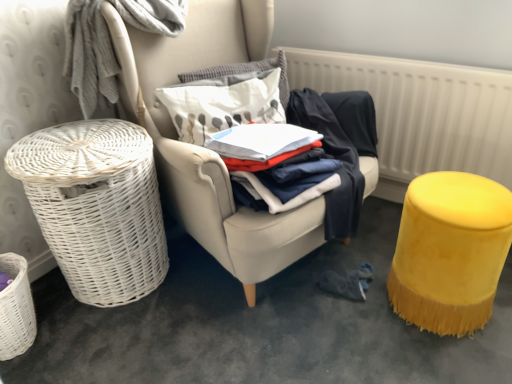
Find the location of a particular element. vacant space in front of white wicker basket at left is located at coordinates (262, 342).